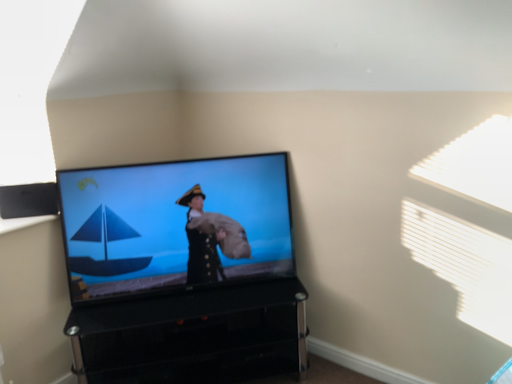
What is the approximate height of black plastic speaker at upper left?

It is 6.10 inches.

Describe the element at coordinates (193, 336) in the screenshot. I see `black glossy tv stand at lower center` at that location.

The image size is (512, 384). What are the coordinates of `black plastic speaker at upper left` in the screenshot? It's located at (28, 200).

Between matte black tv at center and black plastic speaker at upper left, which one appears on the left side from the viewer's perspective?

Positioned to the left is black plastic speaker at upper left.

Is matte black tv at center taller than black plastic speaker at upper left?

Correct, matte black tv at center is much taller as black plastic speaker at upper left.

Considering the relative sizes of matte black tv at center and black plastic speaker at upper left in the image provided, is matte black tv at center bigger than black plastic speaker at upper left?

Yes.

Would you say matte black tv at center is a long distance from black plastic speaker at upper left?

No, matte black tv at center is in close proximity to black plastic speaker at upper left.

What's the angular difference between matte black tv at center and black glossy tv stand at lower center's facing directions?

matte black tv at center and black glossy tv stand at lower center are facing 0.518 degrees away from each other.

Based on the photo, considering the sizes of objects matte black tv at center and black glossy tv stand at lower center in the image provided, who is shorter, matte black tv at center or black glossy tv stand at lower center?

black glossy tv stand at lower center is shorter.

Based on the photo, considering the sizes of objects matte black tv at center and black glossy tv stand at lower center in the image provided, who is smaller, matte black tv at center or black glossy tv stand at lower center?

Smaller between the two is matte black tv at center.

Can you confirm if matte black tv at center is positioned to the right of black glossy tv stand at lower center?

No, matte black tv at center is not to the right of black glossy tv stand at lower center.

From the image's perspective, which one is positioned lower, black glossy tv stand at lower center or matte black tv at center?

black glossy tv stand at lower center, from the image's perspective.

Choose the correct answer: Is black glossy tv stand at lower center inside matte black tv at center or outside it?

black glossy tv stand at lower center is located beyond the bounds of matte black tv at center.

Is black glossy tv stand at lower center oriented away from matte black tv at center?

black glossy tv stand at lower center does not have its back to matte black tv at center.

What's the angular difference between black plastic speaker at upper left and black glossy tv stand at lower center's facing directions?

The facing directions of black plastic speaker at upper left and black glossy tv stand at lower center are 2.18 degrees apart.

Does black plastic speaker at upper left turn towards black glossy tv stand at lower center?

No, black plastic speaker at upper left does not turn towards black glossy tv stand at lower center.

Based on the photo, considering the sizes of objects black plastic speaker at upper left and black glossy tv stand at lower center in the image provided, who is bigger, black plastic speaker at upper left or black glossy tv stand at lower center?

Bigger between the two is black glossy tv stand at lower center.

Locate an element on the screen. Image resolution: width=512 pixels, height=384 pixels. speaker behind the black glossy tv stand at lower center is located at coordinates (28, 200).

At what (x,y) coordinates should I click in order to perform the action: click on furniture below the black plastic speaker at upper left (from a real-world perspective). Please return your answer as a coordinate pair (x, y). Looking at the image, I should click on (193, 336).

Is black glossy tv stand at lower center inside the boundaries of black plastic speaker at upper left, or outside?

black glossy tv stand at lower center is located beyond the bounds of black plastic speaker at upper left.

Is black glossy tv stand at lower center oriented towards black plastic speaker at upper left?

No, black glossy tv stand at lower center is not facing towards black plastic speaker at upper left.

Looking at this image, would you say black plastic speaker at upper left is inside or outside matte black tv at center?

black plastic speaker at upper left cannot be found inside matte black tv at center.

Is black plastic speaker at upper left not close to matte black tv at center?

No, black plastic speaker at upper left is not far away from matte black tv at center.

From the image's perspective, which is below, black plastic speaker at upper left or matte black tv at center?

matte black tv at center is shown below in the image.

Relative to matte black tv at center, is black plastic speaker at upper left in front or behind?

In the image, black plastic speaker at upper left appears behind matte black tv at center.

This screenshot has height=384, width=512. In order to click on speaker located behind the matte black tv at center in this screenshot , I will do `click(28, 200)`.

At what (x,y) coordinates should I click in order to perform the action: click on furniture in front of the matte black tv at center. Please return your answer as a coordinate pair (x, y). Looking at the image, I should click on (193, 336).

Based on their spatial positions, is black plastic speaker at upper left or black glossy tv stand at lower center further from matte black tv at center?

Based on the image, black plastic speaker at upper left appears to be further to matte black tv at center.

Based on their spatial positions, is black glossy tv stand at lower center or black plastic speaker at upper left further from matte black tv at center?

black plastic speaker at upper left is further to matte black tv at center.

Based on their spatial positions, is matte black tv at center or black plastic speaker at upper left closer to black glossy tv stand at lower center?

matte black tv at center is closer to black glossy tv stand at lower center.

When comparing their distances from black glossy tv stand at lower center, does black plastic speaker at upper left or matte black tv at center seem further?

Among the two, black plastic speaker at upper left is located further to black glossy tv stand at lower center.

Estimate the real-world distances between objects in this image. Which object is further from black plastic speaker at upper left, matte black tv at center or black glossy tv stand at lower center?

black glossy tv stand at lower center lies further to black plastic speaker at upper left than the other object.

Which object lies nearer to the anchor point black plastic speaker at upper left, black glossy tv stand at lower center or matte black tv at center?

The object closer to black plastic speaker at upper left is matte black tv at center.

You are a GUI agent. You are given a task and a screenshot of the screen. Output one action in this format:
    pyautogui.click(x=<x>, y=<y>)
    Task: Click on the television located between black plastic speaker at upper left and black glossy tv stand at lower center in the left-right direction
    The width and height of the screenshot is (512, 384).
    Given the screenshot: What is the action you would take?
    pyautogui.click(x=170, y=224)